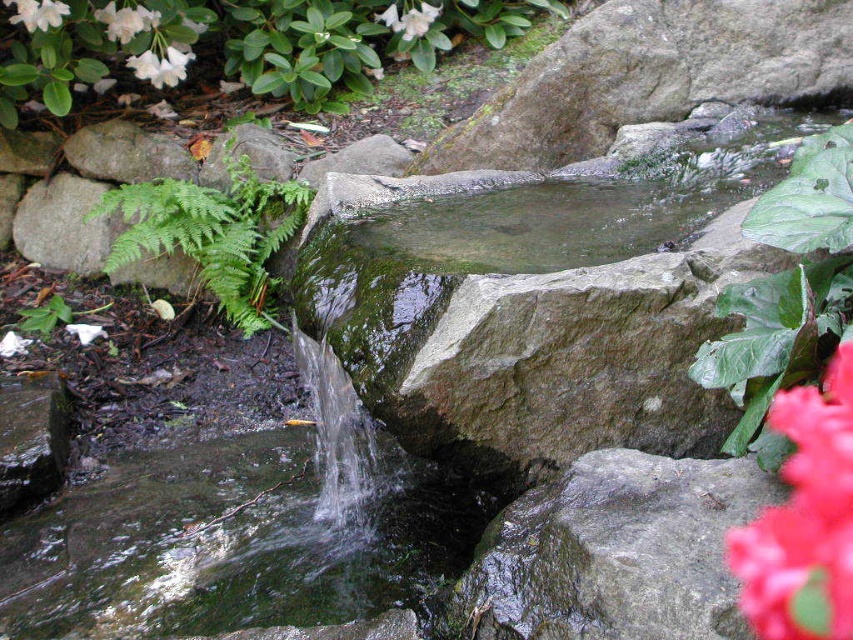
Question: Which point appears closest to the camera in this image?

Choices:
 (A) (294, 460)
 (B) (838, 468)
 (C) (199, 237)
 (D) (582, 474)

Answer: (B)

Question: Which is nearer to the vivid red petals at lower right?

Choices:
 (A) white glossy flowers at upper left
 (B) white matte flower at upper left
 (C) gray rough rock at center
 (D) clear water stream at center

Answer: (C)

Question: Where is white glossy flowers at upper left located in relation to white matte flower at upper left in the image?

Choices:
 (A) left
 (B) right

Answer: (B)

Question: Can you confirm if clear water stream at center is positioned below gray rough rock at center?

Choices:
 (A) yes
 (B) no

Answer: (A)

Question: Considering the relative positions of white glossy flowers at upper left and vivid red petals at lower right in the image provided, where is white glossy flowers at upper left located with respect to vivid red petals at lower right?

Choices:
 (A) right
 (B) left

Answer: (B)

Question: Among these objects, which one is farthest from the camera?

Choices:
 (A) green leafy fern at left
 (B) vivid red petals at lower right
 (C) white matte flower at upper left
 (D) gray rough rock at center

Answer: (A)